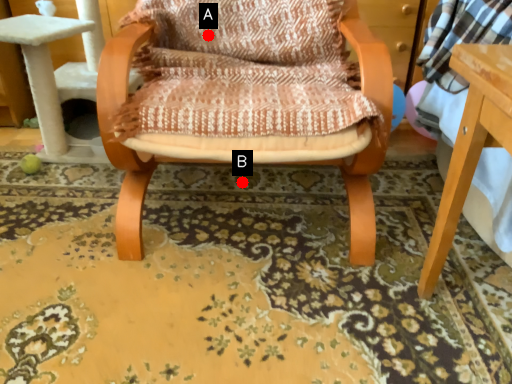
Question: Two points are circled on the image, labeled by A and B beside each circle. Which point is closer to the camera?

Choices:
 (A) A is closer
 (B) B is closer

Answer: (A)